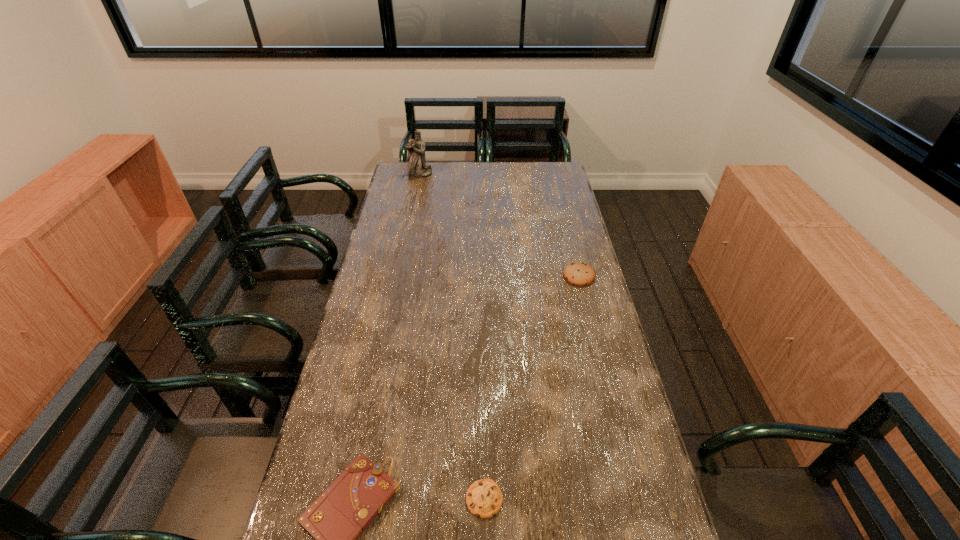
This screenshot has width=960, height=540. What are the coordinates of `the tallest object` in the screenshot? It's located at (417, 167).

Where is `the farthest object`? the farthest object is located at coordinates (417, 167).

Find the location of a particular element. The width and height of the screenshot is (960, 540). the right cookie is located at coordinates (579, 274).

Find the location of a particular element. the taller cookie is located at coordinates (579, 274).

This screenshot has height=540, width=960. I want to click on the nearer cookie, so pyautogui.click(x=484, y=499).

Locate an element on the screen. The height and width of the screenshot is (540, 960). the shortest object is located at coordinates (484, 499).

What are the coordinates of `vacant space situated on the front-facing side of the tallest object` in the screenshot? It's located at (415, 200).

Identify the location of free spot located on the left of the second farthest object. (502, 276).

Locate an element on the screen. The height and width of the screenshot is (540, 960). free space located 0.300m on the left of the nearer cookie is located at coordinates (336, 498).

Image resolution: width=960 pixels, height=540 pixels. What are the coordinates of `object present at the far edge` in the screenshot? It's located at (417, 167).